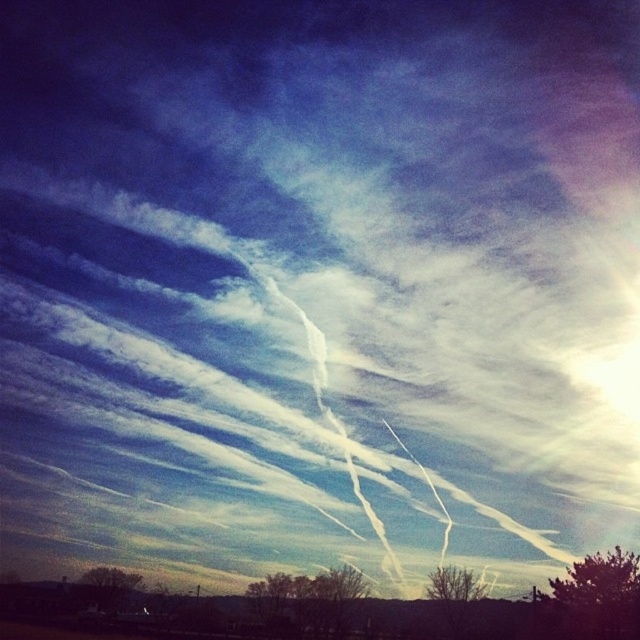
Is bare branches at lower center behind brown textured tree at lower right?

Yes, bare branches at lower center is further from the viewer.

Can you confirm if bare branches at lower center is wider than brown textured tree at lower right?

Indeed, bare branches at lower center has a greater width compared to brown textured tree at lower right.

Is point (339, 612) closer to camera compared to point (442, 572)?

That is False.

The width and height of the screenshot is (640, 640). Identify the location of bare branches at lower center. (336, 596).

Does bare branches at lower center have a greater width compared to brown textured tree at lower left?

Incorrect, bare branches at lower center's width does not surpass brown textured tree at lower left's.

The height and width of the screenshot is (640, 640). Identify the location of bare branches at lower center. (336, 596).

Identify the location of bare branches at lower center. The image size is (640, 640). (336, 596).

Which is more to the left, green leafy tree at lower right or brown textured tree at lower left?

Positioned to the left is brown textured tree at lower left.

Is green leafy tree at lower right below brown textured tree at lower left?

No, green leafy tree at lower right is not below brown textured tree at lower left.

Where is `green leafy tree at lower right`? Image resolution: width=640 pixels, height=640 pixels. green leafy tree at lower right is located at coordinates (595, 598).

Image resolution: width=640 pixels, height=640 pixels. Identify the location of green leafy tree at lower right. (595, 598).